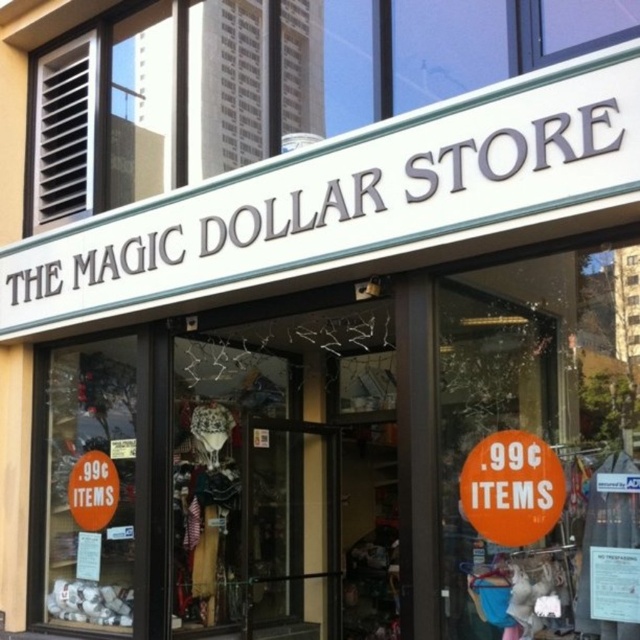
You are a customer entering The Magic Dollar Store and notice two orange signs near the entrance. The orange matte sign at lower right and the orange paper sign at lower left. Which sign is narrower?

The orange matte sign at lower right is narrower than the orange paper sign at lower left.

You are a customer entering The Magic Dollar Store and notice two orange signs near the entrance. Which sign, the orange matte sign at lower right or the orange paper sign at lower left, is located to the right side of the other?

The orange matte sign at lower right is positioned on the right side of the orange paper sign at lower left.

You are a customer standing at the entrance of The Magic Dollar Store. You see two signs, the orange matte sign at lower right and the orange paper sign at lower left. If you want to reach both signs to read them, which direction should you walk first to minimize the distance you have to walk?

To minimize the distance walked, you should first walk towards the orange paper sign at lower left, then proceed to the orange matte sign at lower right since they are 6.63 feet apart from each other.